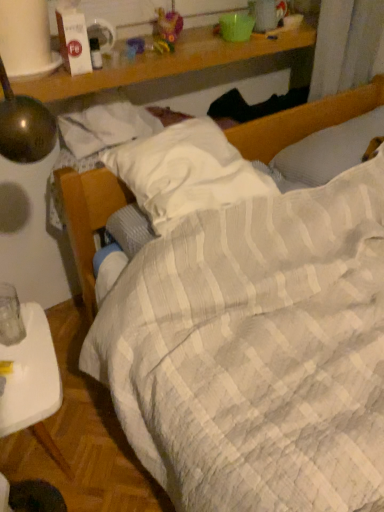
Question: Is white plastic tray at lower left at the right side of white quilted pillow at center, the second pillow when ordered from right to left?

Choices:
 (A) yes
 (B) no

Answer: (B)

Question: Is white plastic tray at lower left looking in the opposite direction of white quilted pillow at center, the second pillow when ordered from right to left?

Choices:
 (A) yes
 (B) no

Answer: (B)

Question: Can you confirm if white plastic tray at lower left is bigger than white quilted pillow at center, which is the first pillow from left to right?

Choices:
 (A) yes
 (B) no

Answer: (A)

Question: Could white quilted pillow at center, which is the first pillow from left to right, be considered to be inside white plastic tray at lower left?

Choices:
 (A) yes
 (B) no

Answer: (B)

Question: Is the position of white plastic tray at lower left less distant than that of white quilted pillow at center, which is the first pillow from left to right?

Choices:
 (A) no
 (B) yes

Answer: (B)

Question: Could you tell me if white plastic tray at lower left is turned towards white quilted pillow at center, the second pillow when ordered from right to left?

Choices:
 (A) yes
 (B) no

Answer: (A)

Question: Is there a large distance between white textured pillow at upper right, marked as the 2th pillow in a left-to-right arrangement, and white plastic tray at lower left?

Choices:
 (A) no
 (B) yes

Answer: (A)

Question: Is white textured pillow at upper right, marked as the 2th pillow in a left-to-right arrangement, turned away from white plastic tray at lower left?

Choices:
 (A) yes
 (B) no

Answer: (B)

Question: From a real-world perspective, does white textured pillow at upper right, which ranks as the 1th pillow in right-to-left order, sit lower than white plastic tray at lower left?

Choices:
 (A) no
 (B) yes

Answer: (A)

Question: Does white textured pillow at upper right, marked as the 2th pillow in a left-to-right arrangement, contain white plastic tray at lower left?

Choices:
 (A) no
 (B) yes

Answer: (A)

Question: From the image's perspective, is white textured pillow at upper right, marked as the 2th pillow in a left-to-right arrangement, located above white plastic tray at lower left?

Choices:
 (A) no
 (B) yes

Answer: (B)

Question: Is white textured pillow at upper right, which ranks as the 1th pillow in right-to-left order, thinner than white plastic tray at lower left?

Choices:
 (A) yes
 (B) no

Answer: (B)

Question: From a real-world perspective, is white plastic tray at lower left located higher than white textured pillow at upper right, marked as the 2th pillow in a left-to-right arrangement?

Choices:
 (A) yes
 (B) no

Answer: (B)